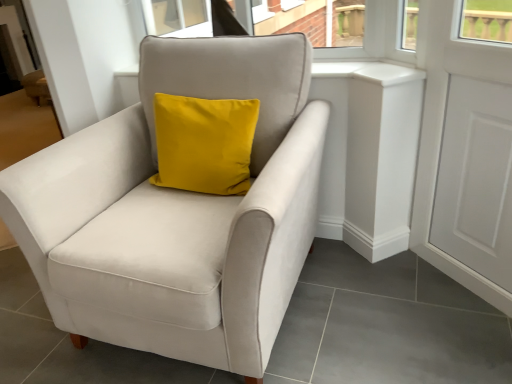
Question: Is white matte door at right further to the viewer compared to suede-like beige armchair at center?

Choices:
 (A) yes
 (B) no

Answer: (A)

Question: Is white matte door at right closer to the viewer compared to suede-like beige armchair at center?

Choices:
 (A) no
 (B) yes

Answer: (A)

Question: Can we say white matte door at right lies outside suede-like beige armchair at center?

Choices:
 (A) no
 (B) yes

Answer: (B)

Question: Does white matte door at right have a smaller size compared to suede-like beige armchair at center?

Choices:
 (A) no
 (B) yes

Answer: (B)

Question: Is white matte door at right to the right of suede-like beige armchair at center from the viewer's perspective?

Choices:
 (A) yes
 (B) no

Answer: (A)

Question: From the image's perspective, would you say white matte door at right is positioned over suede-like beige armchair at center?

Choices:
 (A) no
 (B) yes

Answer: (B)

Question: Is suede-like beige armchair at center positioned before white matte door at right?

Choices:
 (A) no
 (B) yes

Answer: (B)

Question: Can white matte door at right be found inside suede-like beige armchair at center?

Choices:
 (A) yes
 (B) no

Answer: (B)

Question: Is suede-like beige armchair at center facing away from white matte door at right?

Choices:
 (A) yes
 (B) no

Answer: (B)

Question: Does suede-like beige armchair at center appear on the left side of white matte door at right?

Choices:
 (A) no
 (B) yes

Answer: (B)

Question: Does suede-like beige armchair at center have a lesser width compared to white matte door at right?

Choices:
 (A) yes
 (B) no

Answer: (B)

Question: Is suede-like beige armchair at center oriented towards white matte door at right?

Choices:
 (A) yes
 (B) no

Answer: (B)

Question: Choose the correct answer: Is suede-like beige armchair at center inside white matte door at right or outside it?

Choices:
 (A) inside
 (B) outside

Answer: (B)